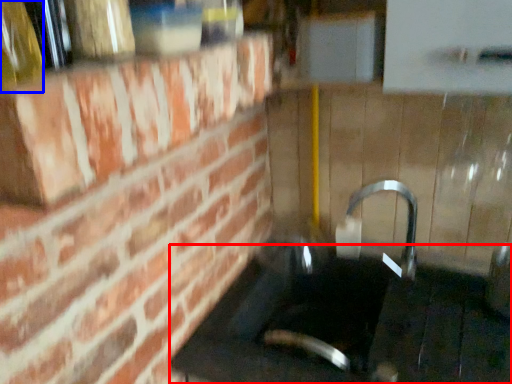
Question: Among these objects, which one is nearest to the camera, counter top (highlighted by a red box) or bottle (highlighted by a blue box)?

Choices:
 (A) counter top
 (B) bottle

Answer: (B)